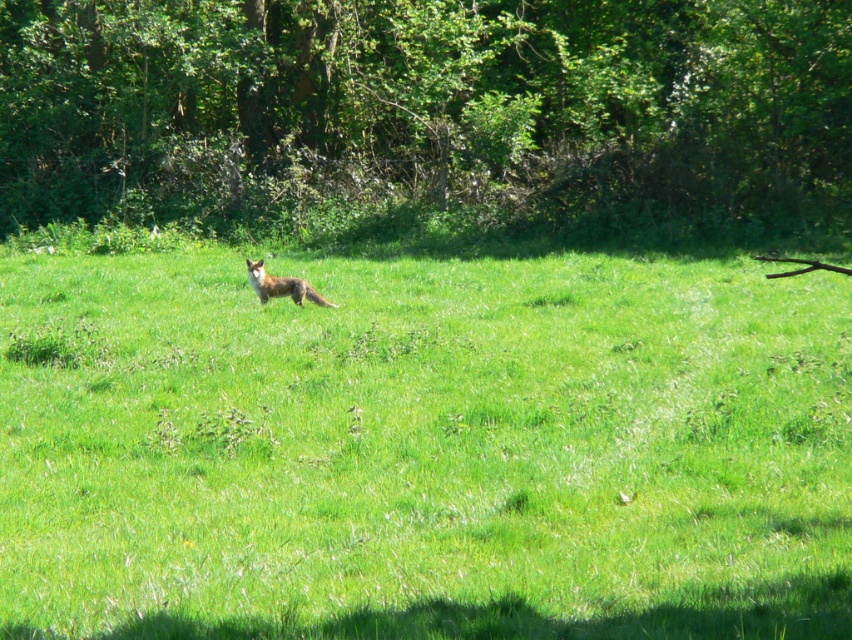
Does green grassy field at center appear on the left side of green leafy tree at center?

No, green grassy field at center is not to the left of green leafy tree at center.

Who is shorter, green grassy field at center or green leafy tree at center?

green grassy field at center is shorter.

Identify the location of green grassy field at center. (423, 449).

Is point (168, 305) farther from camera compared to point (258, 296)?

No.

Can you confirm if green grassy field at center is positioned to the left of reddish-brown fur fox at center?

Incorrect, green grassy field at center is not on the left side of reddish-brown fur fox at center.

This screenshot has width=852, height=640. Describe the element at coordinates (423, 449) in the screenshot. I see `green grassy field at center` at that location.

This screenshot has width=852, height=640. Find the location of `green grassy field at center`. green grassy field at center is located at coordinates (423, 449).

Does point (441, 177) lie behind point (262, 280)?

Yes, it is behind point (262, 280).

Image resolution: width=852 pixels, height=640 pixels. Find the location of `green leafy tree at center`. green leafy tree at center is located at coordinates (423, 112).